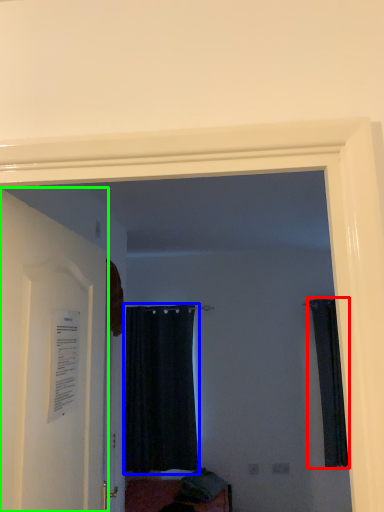
Question: Which is farther away from curtain (highlighted by a red box)? curtain (highlighted by a blue box) or door (highlighted by a green box)?

Choices:
 (A) curtain
 (B) door

Answer: (B)